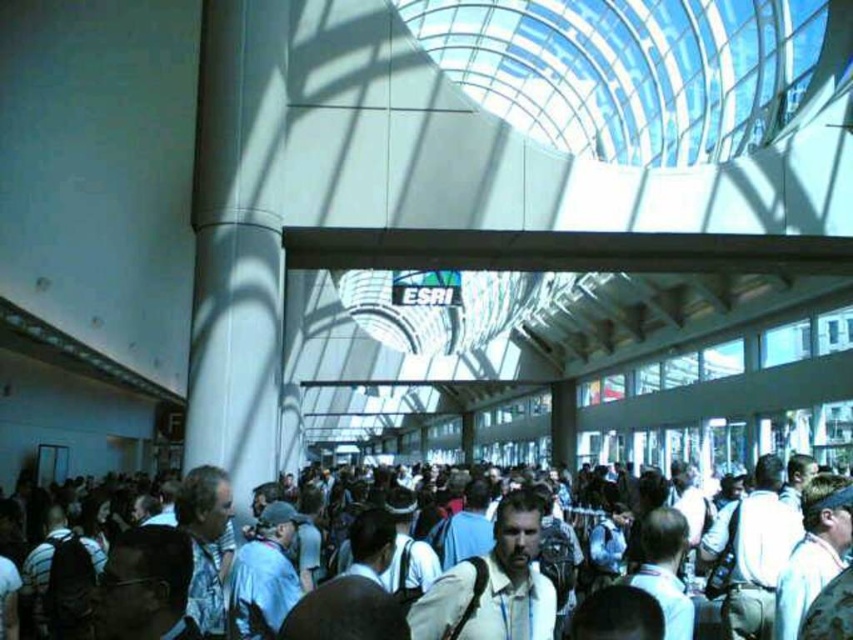
From the picture: You are standing at the entrance of the convention center and see the white fabric crowd at center and the light beige shirt at center. Which of these two is located to the left when viewed from your perspective?

The white fabric crowd at center is positioned on the left side of the light beige shirt at center, so when viewed from your perspective at the entrance, the white fabric crowd at center would be to the left of the light beige shirt at center.

Based on the scene description, which object is wider, the white fabric crowd at center or the light beige shirt at center?

The white fabric crowd at center is wider than the light beige shirt at center according to the description.